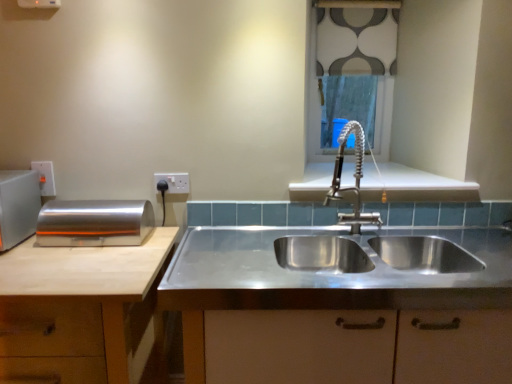
Locate an element on the screen. This screenshot has width=512, height=384. vacant area that lies between silver metallic breadbox at left, acting as the second appliance starting from the left, and satin silver toaster at left, acting as the 2th appliance starting from the right is located at coordinates (57, 246).